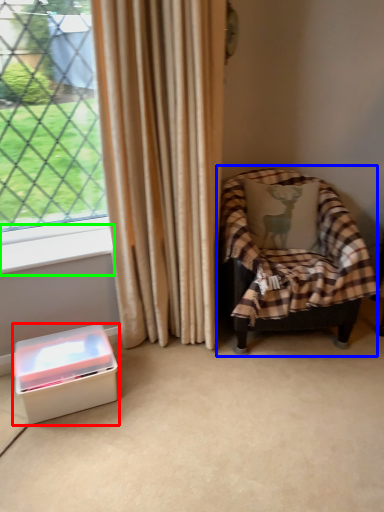
Question: Which object is the farthest from box (highlighted by a red box)? Choose among these: chair (highlighted by a blue box) or window sill (highlighted by a green box).

Choices:
 (A) chair
 (B) window sill

Answer: (A)